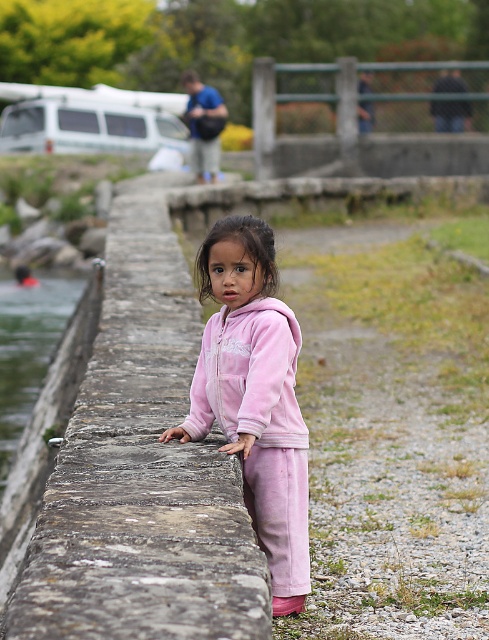
You are a photographer trying to capture a shot of the velvet pink tracksuit at center and the stone wall at center. The camera you are using has a maximum focus range of 7 feet. Can you ensure both subjects are in focus without moving the camera?

The stone wall at center and velvet pink tracksuit at center are 7.41 feet apart from each other. Since the maximum focus range is 7 feet, the distance between them exceeds the camera capability. Therefore, both subjects cannot be in focus simultaneously.

In the scene shown: You are a photographer trying to capture the velvet pink tracksuit at center and the stone wall at center in a single shot. Based on their positions, which object should you adjust your camera angle to focus on first to ensure both are in frame?

The stone wall at center is positioned on the left side of velvet pink tracksuit at center, so you should adjust your camera angle to focus on the stone wall at center first to ensure both are in frame.

You are a photographer trying to capture the child in the velvet pink tracksuit at center. To get a better shot, you want to position yourself so that the stone wall at center is not blocking the view of the child. Is this possible based on their current positions?

The stone wall at center is positioned over the velvet pink tracksuit at center, meaning the wall is in front of the child. To avoid blocking the view, you would need to move to a position where the wall is no longer between you and the child, such as moving around to the side or behind the wall.